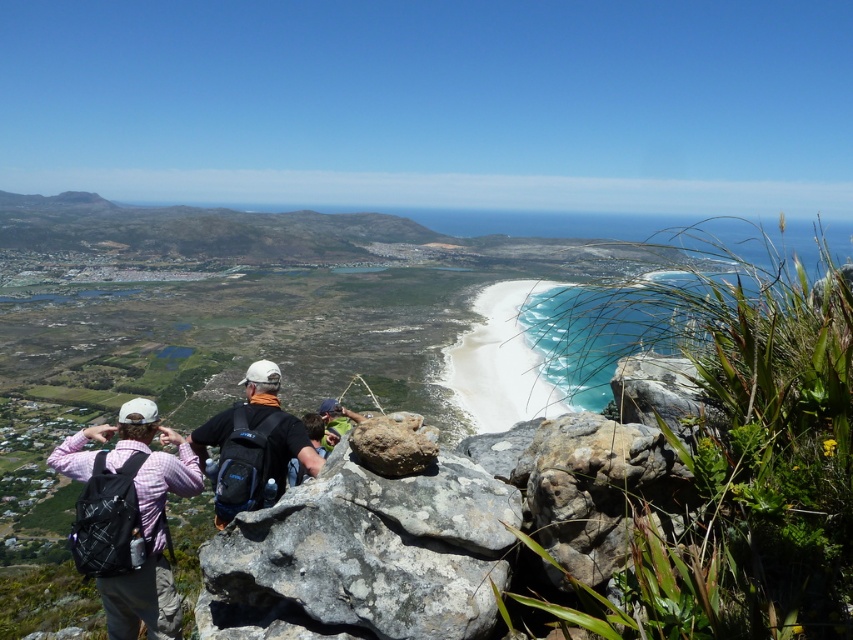
Does white sand beach at center appear under matte black backpack at center?

Incorrect, white sand beach at center is not positioned below matte black backpack at center.

Is point (531, 394) behind point (264, 452)?

Yes.

Between point (515, 362) and point (247, 376), which one is positioned behind?

Point (515, 362)

Locate an element on the screen. white sand beach at center is located at coordinates point(498,362).

Image resolution: width=853 pixels, height=640 pixels. What do you see at coordinates (128, 516) in the screenshot?
I see `plaid fabric backpack at lower left` at bounding box center [128, 516].

Who is more distant from viewer, (x=161, y=440) or (x=387, y=442)?

Positioned behind is point (x=161, y=440).

Find the location of a particular element. plaid fabric backpack at lower left is located at coordinates (128, 516).

Which is in front, point (216, 438) or point (357, 449)?

Positioned in front is point (357, 449).

Is matte black backpack at center to the left of rusty rock at center from the viewer's perspective?

Correct, you'll find matte black backpack at center to the left of rusty rock at center.

What are the coordinates of `matte black backpack at center` in the screenshot? It's located at (253, 444).